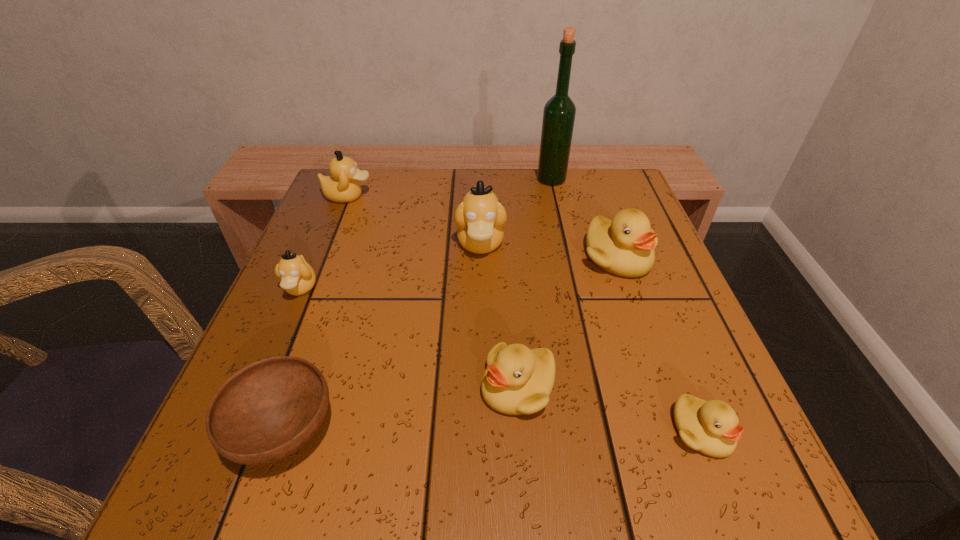
At what (x,y) coordinates should I click in order to perform the action: click on free point between the farthest object and the bowl. Please return your answer as a coordinate pair (x, y). The width and height of the screenshot is (960, 540). Looking at the image, I should click on (418, 306).

You are a GUI agent. You are given a task and a screenshot of the screen. Output one action in this format:
    pyautogui.click(x=<x>, y=<y>)
    Task: Click on the vacant space that's between the smallest tan duckling and the seventh nearest object
    The image size is (960, 540).
    Given the screenshot: What is the action you would take?
    pyautogui.click(x=324, y=242)

Identify the location of empty space that is in between the bowl and the biggest yellow duckling. This screenshot has height=540, width=960. (451, 345).

Find the location of `blank region between the bowl and the smallest yellow duckling`. blank region between the bowl and the smallest yellow duckling is located at coordinates (493, 431).

You are a GUI agent. You are given a task and a screenshot of the screen. Output one action in this format:
    pyautogui.click(x=<x>, y=<y>)
    Task: Click on the vacant area between the nearest tan duckling and the farthest yellow duckling
    
    Given the screenshot: What is the action you would take?
    pyautogui.click(x=459, y=273)

Locate which object ranks seventh in proximity to the bowl. Please provide its 2D coordinates. Your answer should be formatted as a tuple, i.e. [(x, y)], where the tuple contains the x and y coordinates of a point satisfying the conditions above.

[(559, 112)]

Where is `the seventh closest object relative to the farthest yellow duckling`? This screenshot has width=960, height=540. the seventh closest object relative to the farthest yellow duckling is located at coordinates (297, 277).

Where is `the fourth closest duckling to the tallest object`? The image size is (960, 540). the fourth closest duckling to the tallest object is located at coordinates (517, 380).

This screenshot has height=540, width=960. What are the coordinates of `duckling that can be found as the fourth closest to the smallest yellow duckling` in the screenshot? It's located at (297, 277).

The width and height of the screenshot is (960, 540). Identify the location of tan duckling identified as the second closest to the smallest tan duckling. (480, 218).